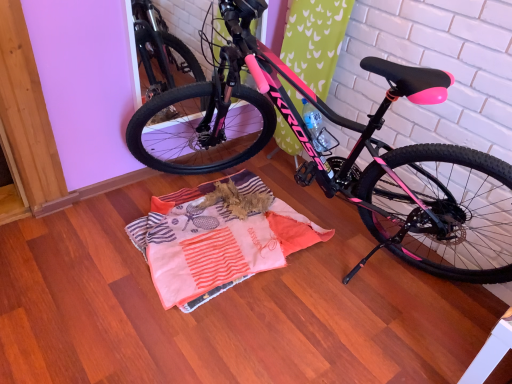
At what (x,y) coordinates should I click in order to perform the action: click on vacant area situated below pink matte bicycle at center (from a real-world perspective). Please return your answer as a coordinate pair (x, y). The height and width of the screenshot is (384, 512). Looking at the image, I should click on (338, 280).